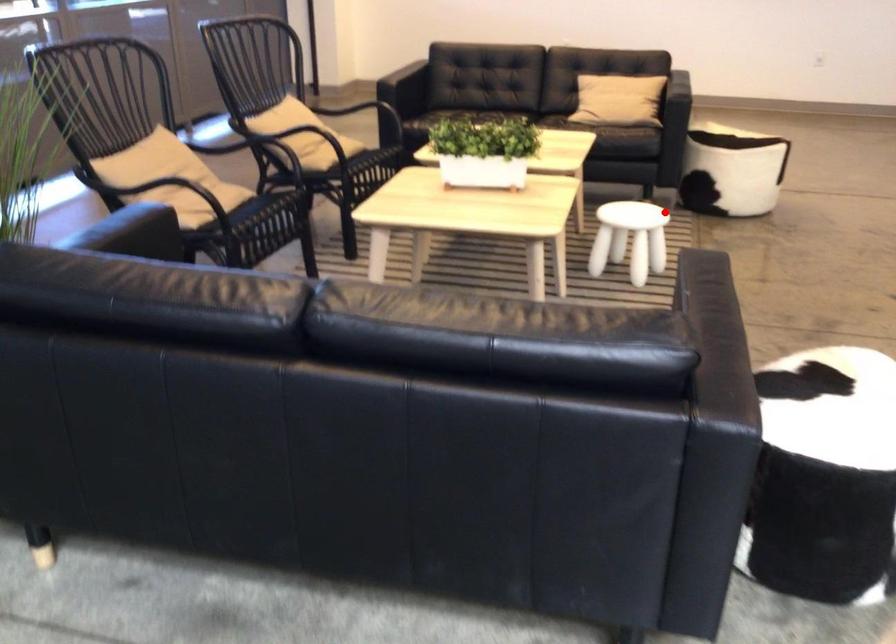
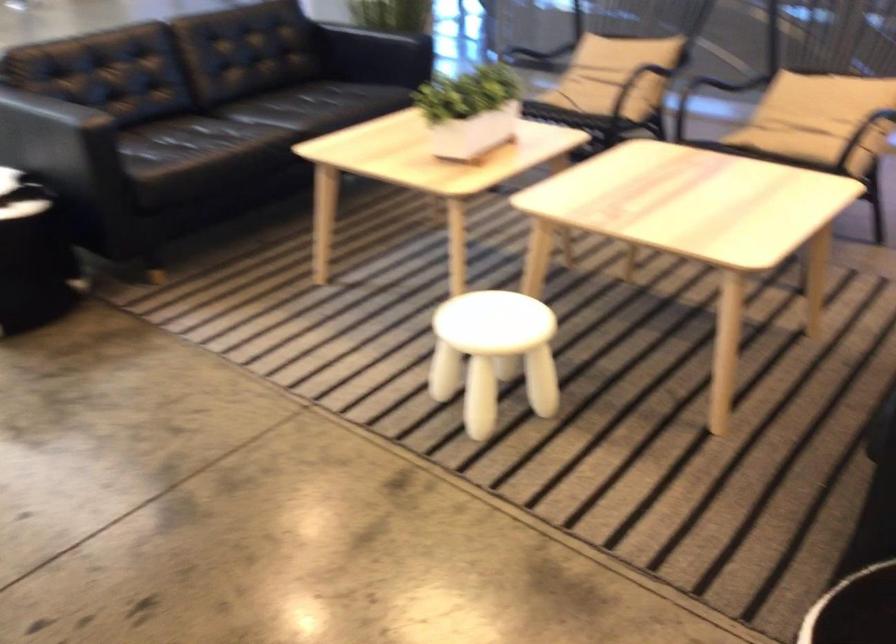
Question: I am providing you with two images of the same scene from different viewpoints. A red point is marked on the first image. At the location where the point appears in image 1, is it still visible in image 2?

Choices:
 (A) Yes
 (B) No

Answer: (A)